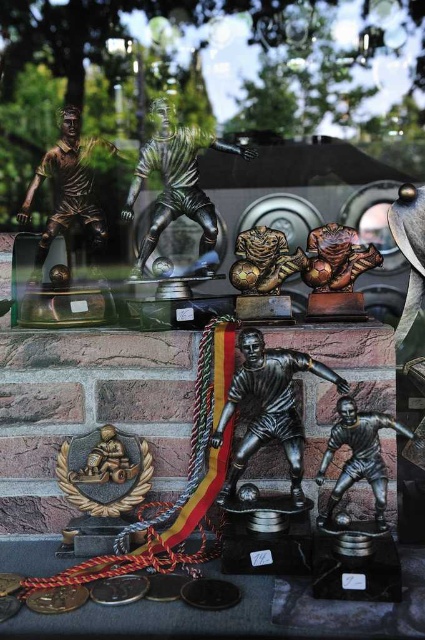
Based on the photo, what is the object located at the coordinates point (269, 406) in the image?

The bronze statue of soccer player at center is located at point (269, 406).